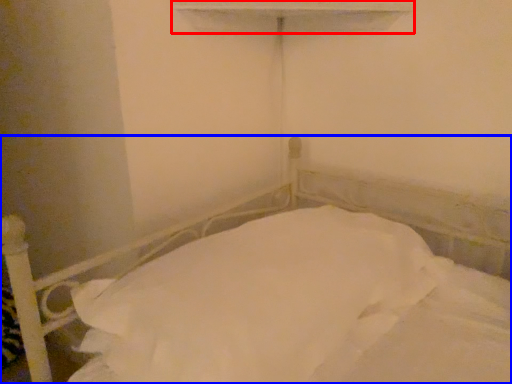
Question: Among these objects, which one is nearest to the camera, window sill (highlighted by a red box) or bed (highlighted by a blue box)?

Choices:
 (A) window sill
 (B) bed

Answer: (B)